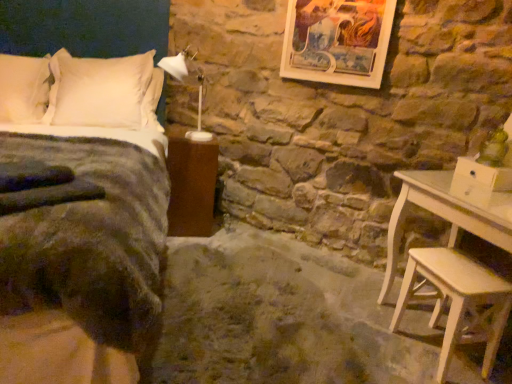
The width and height of the screenshot is (512, 384). Find the location of `free space below light wood stool at lower right (from a real-world perspective)`. free space below light wood stool at lower right (from a real-world perspective) is located at coordinates (430, 354).